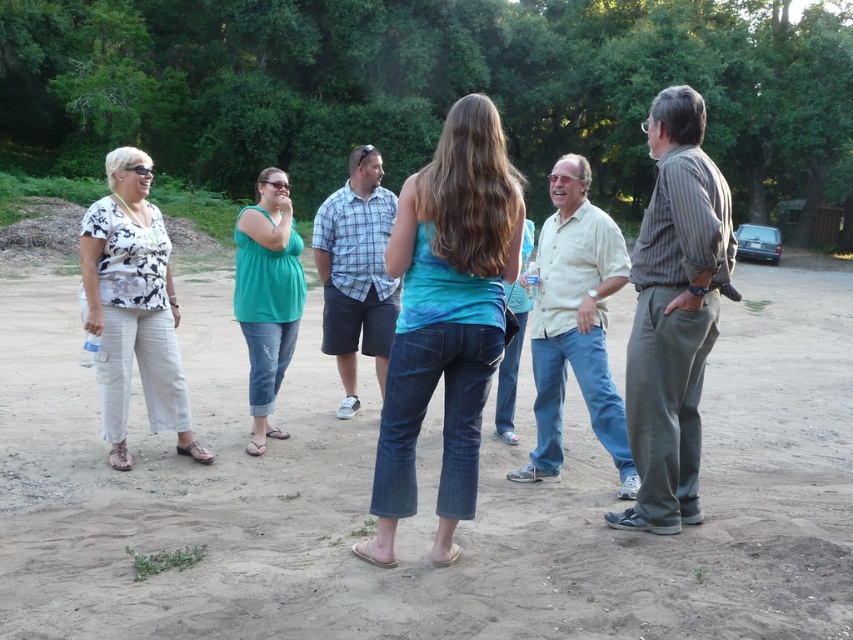
The height and width of the screenshot is (640, 853). What do you see at coordinates (445, 317) in the screenshot? I see `blue denim jeans at center` at bounding box center [445, 317].

This screenshot has width=853, height=640. Identify the location of blue denim jeans at center. (445, 317).

Does point (474, 204) come closer to viewer compared to point (323, 214)?

Yes, it is in front of point (323, 214).

Where is `blue denim jeans at center`? The height and width of the screenshot is (640, 853). blue denim jeans at center is located at coordinates (445, 317).

Is white linen pants at left smaller than teal matte tank top at center?

Yes.

Is white linen pants at left bigger than teal matte tank top at center?

Incorrect, white linen pants at left is not larger than teal matte tank top at center.

Locate an element on the screen. white linen pants at left is located at coordinates (132, 307).

I want to click on white linen pants at left, so click(132, 307).

Looking at this image, is striped cotton shirt at right to the left of teal matte tank top at center from the viewer's perspective?

In fact, striped cotton shirt at right is to the right of teal matte tank top at center.

Consider the image. Between striped cotton shirt at right and teal matte tank top at center, which one has more height?

Standing taller between the two is striped cotton shirt at right.

Does point (669, 525) come closer to viewer compared to point (293, 291)?

That is True.

Find the location of a particular element. The image size is (853, 640). striped cotton shirt at right is located at coordinates click(x=672, y=314).